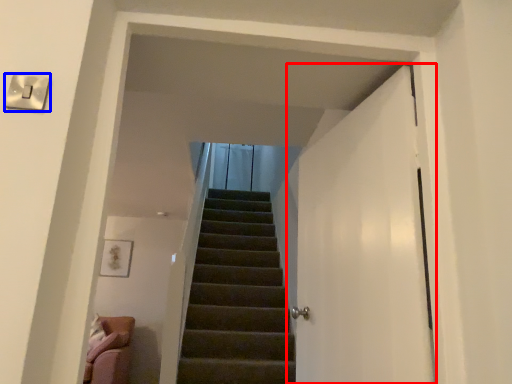
Question: Which point is further to the camera, door (highlighted by a red box) or electric outlet (highlighted by a blue box)?

Choices:
 (A) door
 (B) electric outlet

Answer: (A)